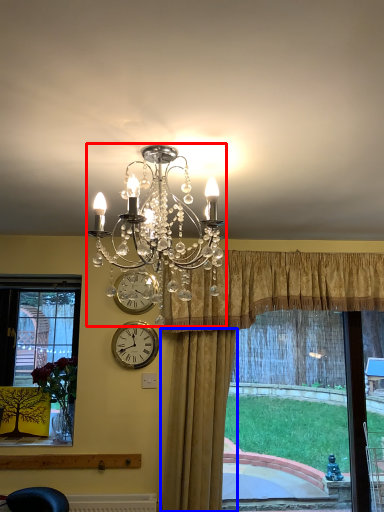
Question: Which object is further to the camera taking this photo, lamp (highlighted by a red box) or curtain (highlighted by a blue box)?

Choices:
 (A) lamp
 (B) curtain

Answer: (B)